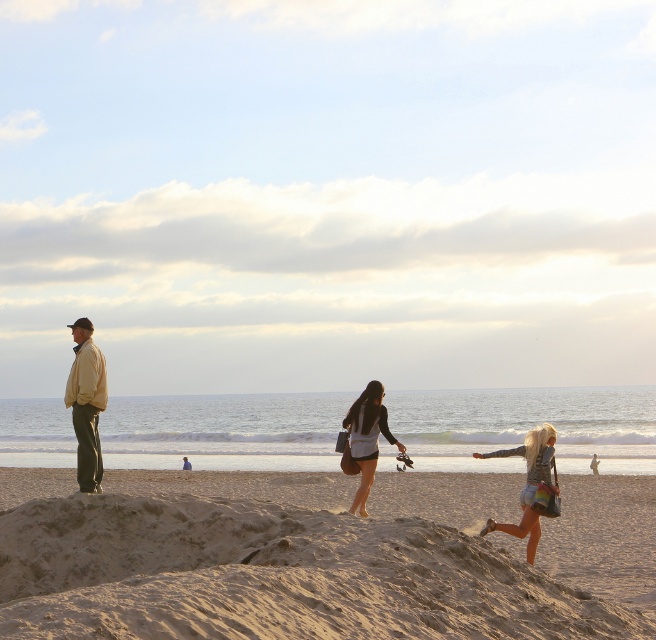
Question: Among these objects, which one is farthest from the camera?

Choices:
 (A) beige sandy mound at center
 (B) matte yellow jacket at left
 (C) denim shorts at center

Answer: (C)

Question: Which point is closer to the camera taking this photo?

Choices:
 (A) (226, 476)
 (B) (104, 374)
 (C) (552, 452)
 (D) (369, 435)

Answer: (B)

Question: Does denim shorts at lower right have a smaller size compared to denim shorts at center?

Choices:
 (A) no
 (B) yes

Answer: (A)

Question: Is denim shorts at lower right to the right of denim shorts at center from the viewer's perspective?

Choices:
 (A) yes
 (B) no

Answer: (A)

Question: Which object is positioned closest to the denim shorts at lower right?

Choices:
 (A) matte yellow jacket at left
 (B) denim shorts at center

Answer: (B)

Question: Is beige sandy mound at center bigger than denim shorts at center?

Choices:
 (A) yes
 (B) no

Answer: (A)